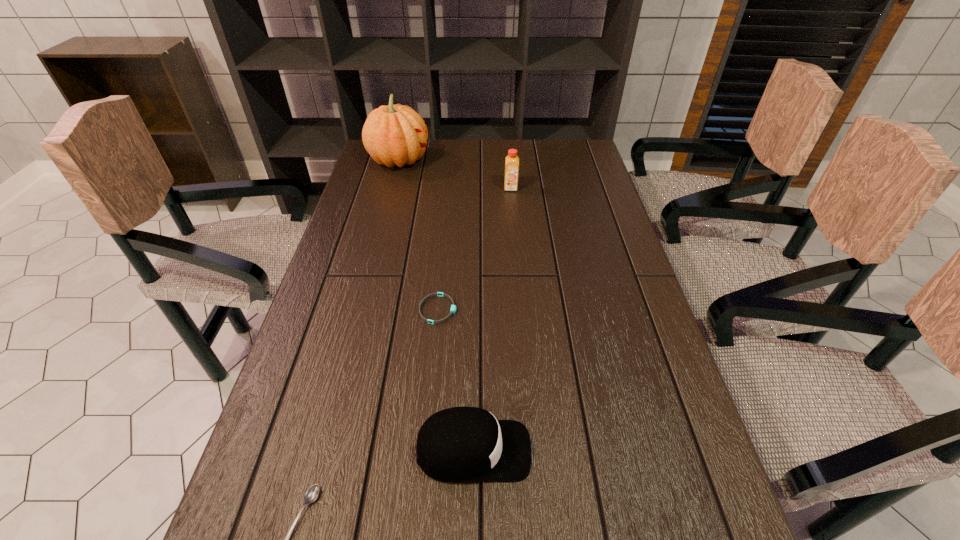
Locate an element on the screen. the tallest object is located at coordinates (393, 135).

I want to click on the farthest object, so click(393, 135).

The width and height of the screenshot is (960, 540). Identify the location of orange juice. (512, 161).

I want to click on the fourth shortest object, so click(x=512, y=161).

In order to click on the fourth farthest object in this screenshot , I will do `click(460, 444)`.

Where is `cap`? The width and height of the screenshot is (960, 540). cap is located at coordinates (460, 444).

Find the location of a particular element. Image resolution: width=960 pixels, height=540 pixels. the fourth tallest object is located at coordinates (453, 307).

Find the location of `the third nearest object`. the third nearest object is located at coordinates (453, 307).

The image size is (960, 540). Identify the location of vacant space located 0.060m on the carved face of the farthest object. (446, 160).

You are a GUI agent. You are given a task and a screenshot of the screen. Output one action in this format:
    pyautogui.click(x=<x>, y=<y>)
    Task: Click on the vacant position located on the front and back of the second tallest object
    The width and height of the screenshot is (960, 540).
    Given the screenshot: What is the action you would take?
    pyautogui.click(x=514, y=224)